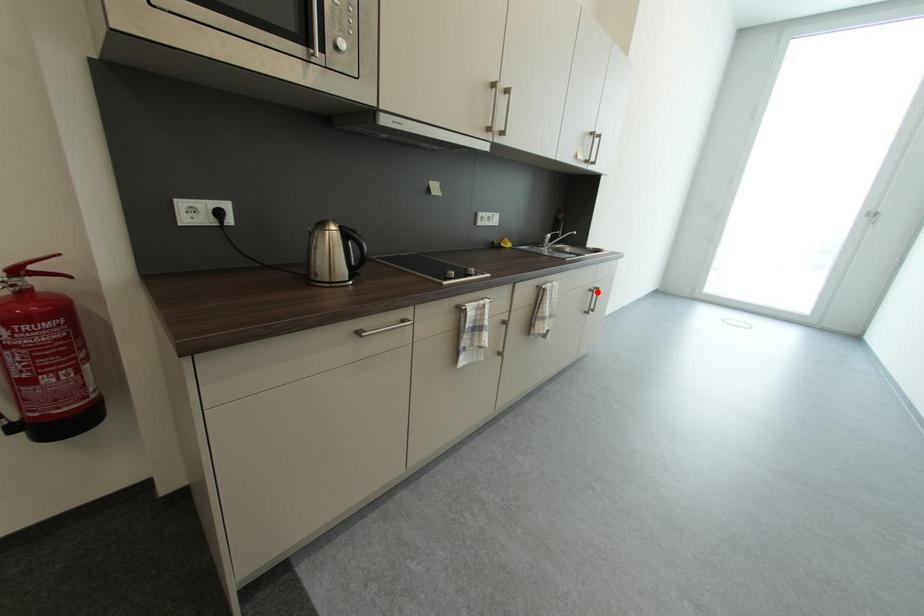
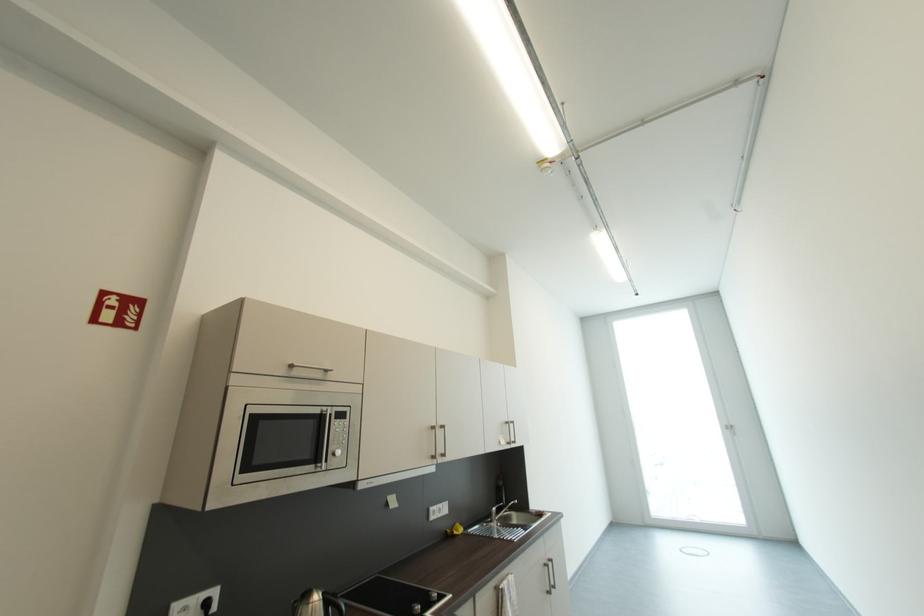
The point at the highlighted location is marked in the first image. Where is the corresponding point in the second image?

(552, 567)